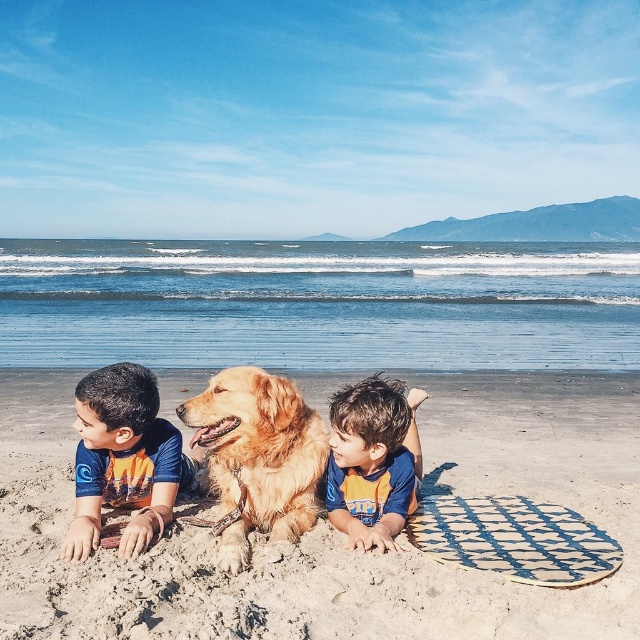
Question: Does golden fur dog at center come behind blue fabric boy at center?

Choices:
 (A) no
 (B) yes

Answer: (A)

Question: Which point is farther from the camera taking this photo?

Choices:
 (A) (106, 467)
 (B) (362, 442)
 (C) (282, 396)

Answer: (A)

Question: Among these objects, which one is nearest to the camera?

Choices:
 (A) blue and orange swimsuit at center
 (B) golden fur dog at center
 (C) blue fabric boy at center

Answer: (B)

Question: Is golden fur dog at center further to the viewer compared to blue fabric boy at center?

Choices:
 (A) yes
 (B) no

Answer: (B)

Question: Estimate the real-world distances between objects in this image. Which object is closer to the golden sand at center?

Choices:
 (A) blue and orange swimsuit at center
 (B) golden fur dog at center

Answer: (A)

Question: Can you confirm if golden fur dog at center is positioned to the right of blue fabric boy at center?

Choices:
 (A) no
 (B) yes

Answer: (B)